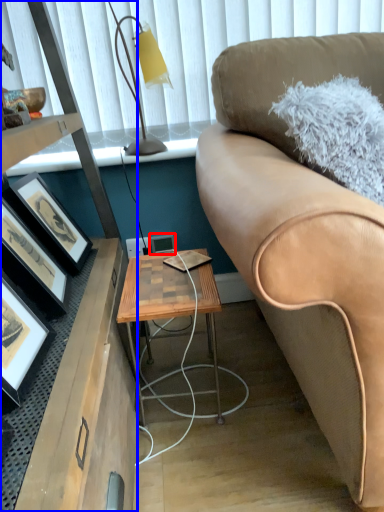
Question: Which object is closer to the camera taking this photo, picture frame (highlighted by a red box) or desk (highlighted by a blue box)?

Choices:
 (A) picture frame
 (B) desk

Answer: (B)